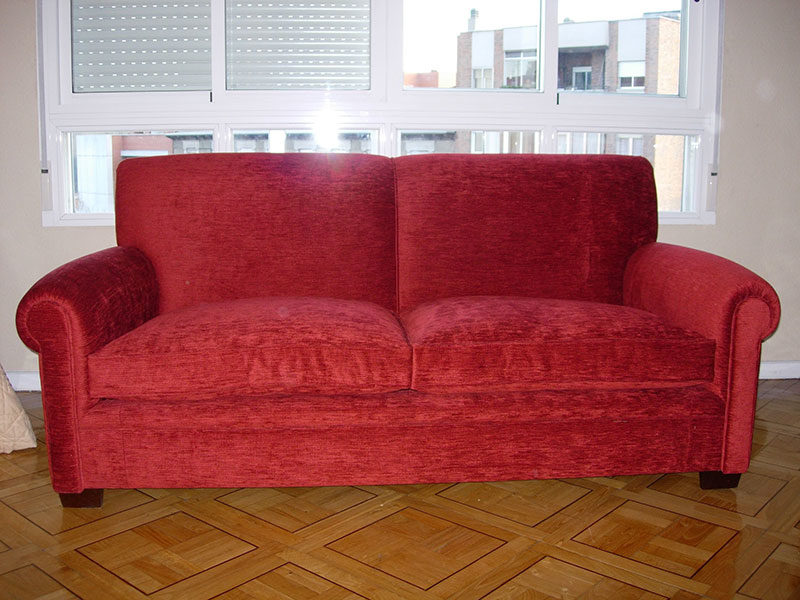
This screenshot has width=800, height=600. What are the coordinates of `wooden floor tiles` in the screenshot? It's located at (181, 528), (58, 521), (404, 538), (552, 556), (664, 507).